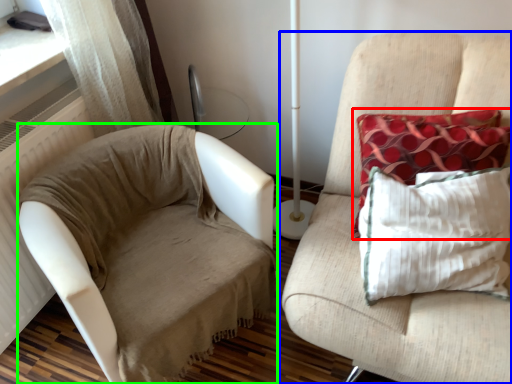
Question: Which object is the closest to the pillow (highlighted by a red box)? Choose among these: furniture (highlighted by a blue box) or studio couch (highlighted by a green box).

Choices:
 (A) furniture
 (B) studio couch

Answer: (A)